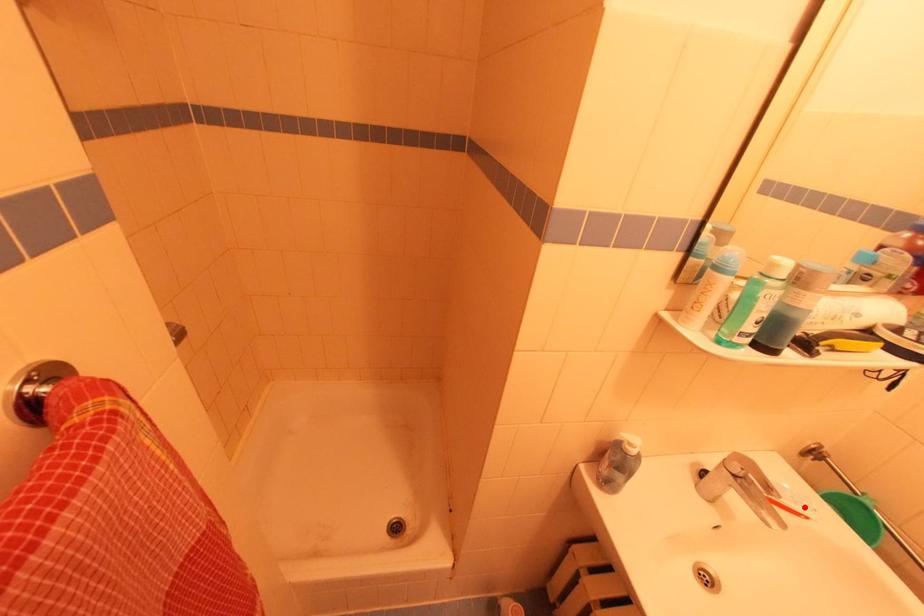
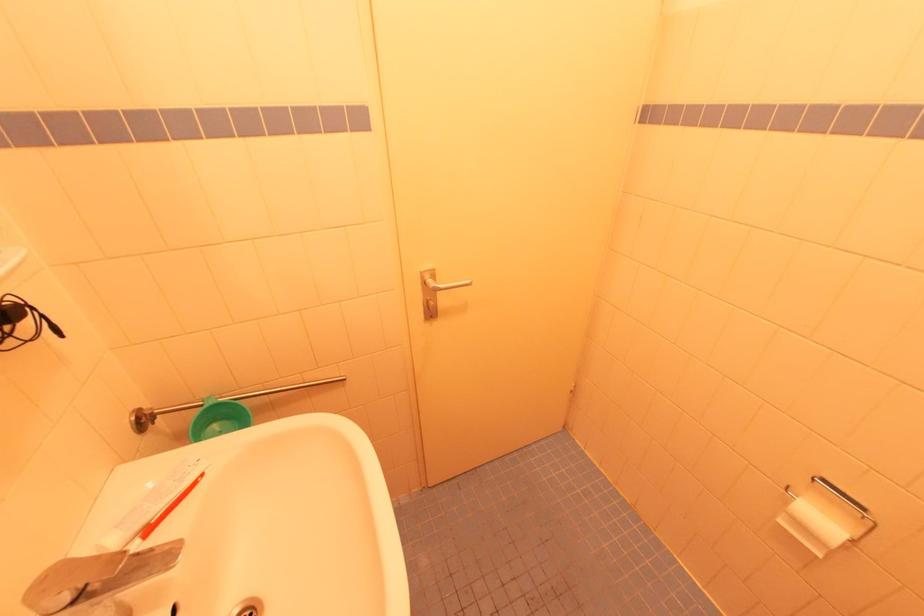
Question: I am providing you with two images of the same scene from different viewpoints. A red point is marked on the first image. Is the red point's position out of view in image 2?

Choices:
 (A) Yes
 (B) No

Answer: (B)